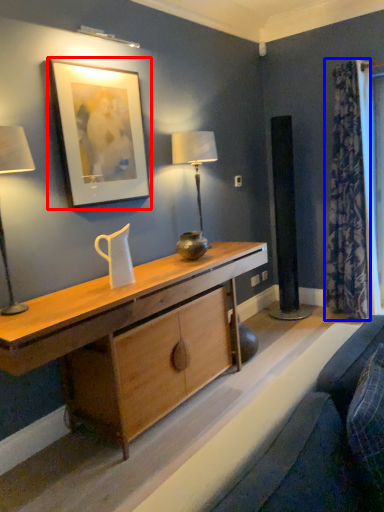
Question: Among these objects, which one is nearest to the camera, picture frame (highlighted by a red box) or curtain (highlighted by a blue box)?

Choices:
 (A) picture frame
 (B) curtain

Answer: (A)